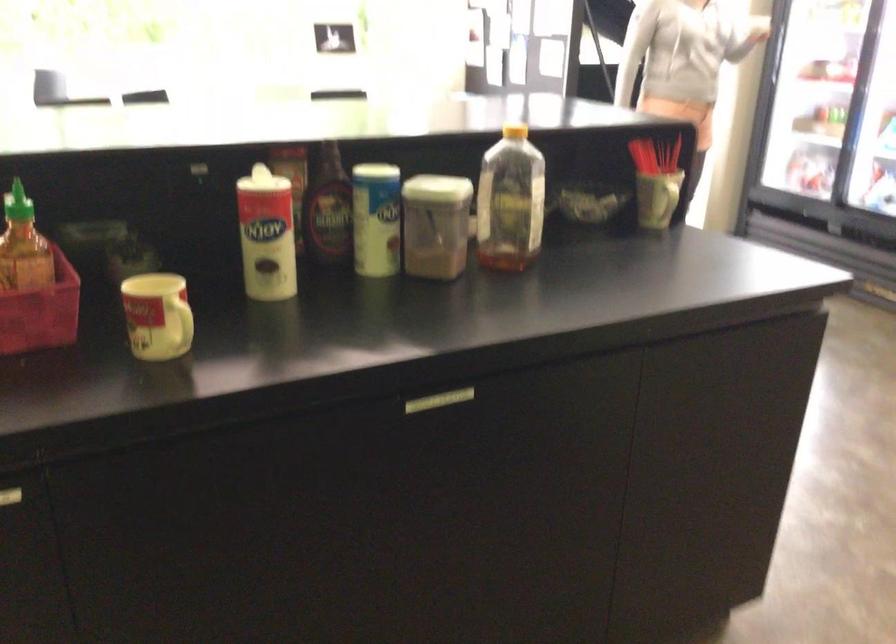
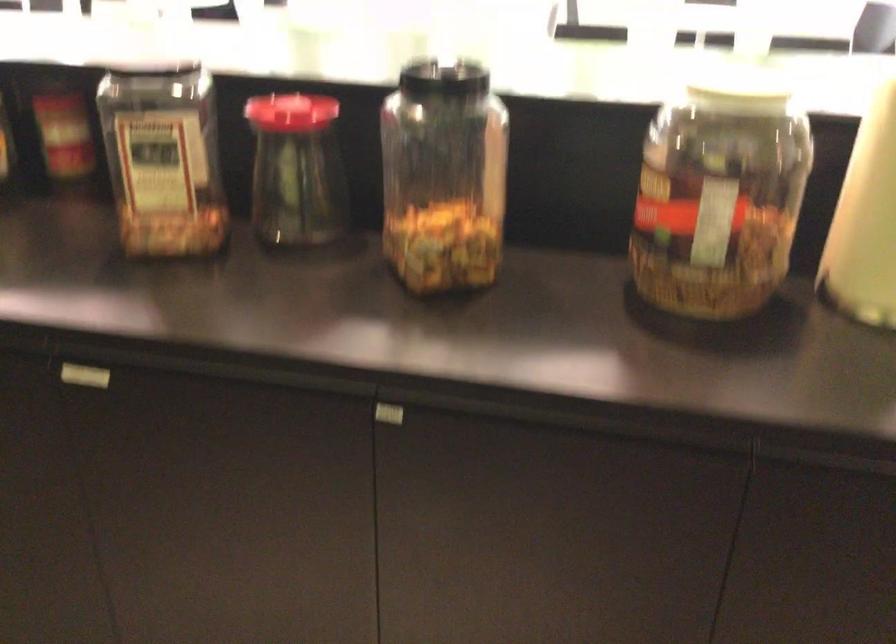
Question: How did the camera likely rotate?

Choices:
 (A) Left
 (B) Right
 (C) Up
 (D) Down

Answer: (A)